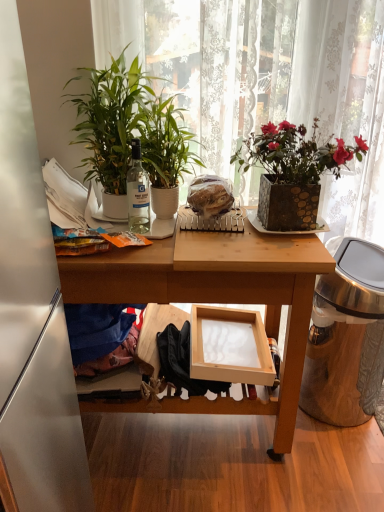
Find the location of `blank area beneath shiny metallic trash can at right (from a real-world perspective)`. blank area beneath shiny metallic trash can at right (from a real-world perspective) is located at coordinates (327, 409).